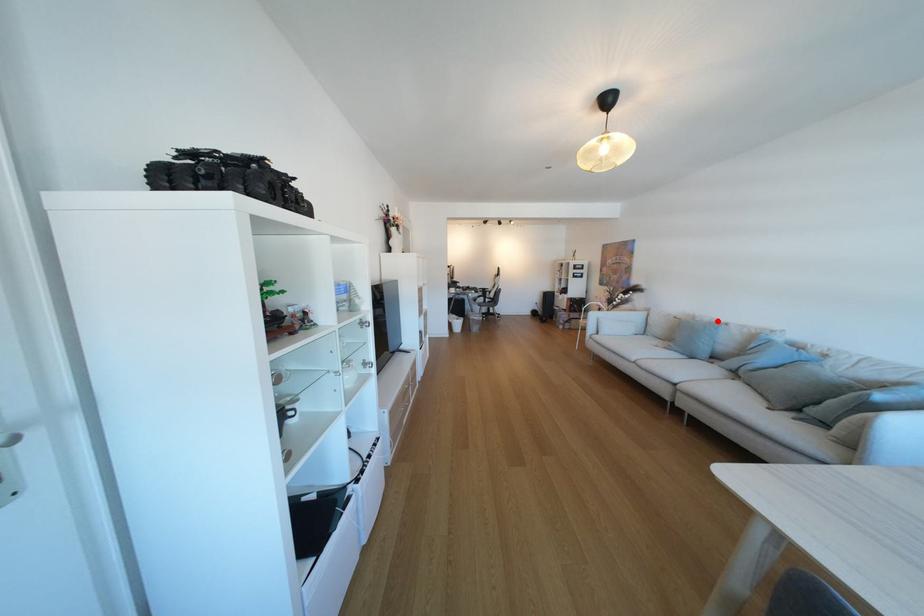
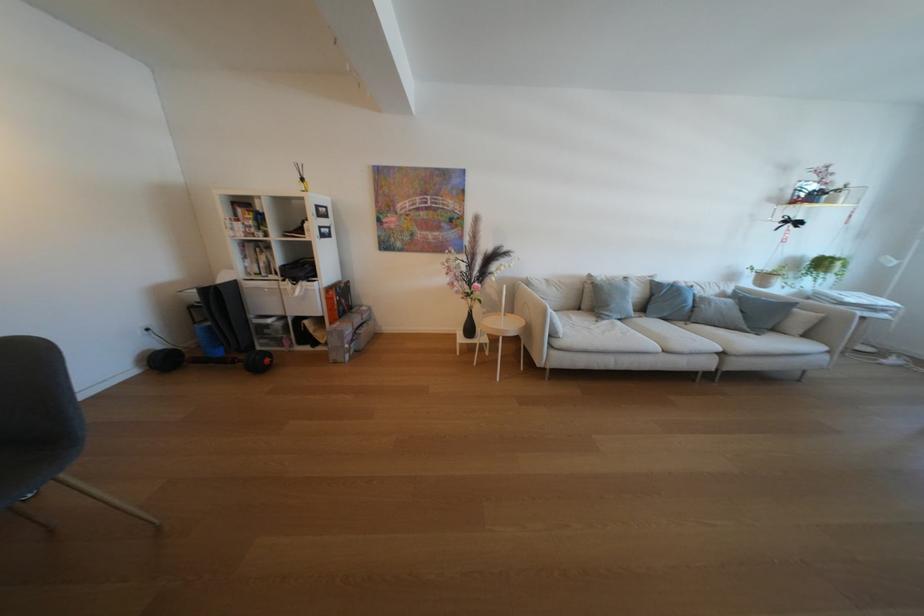
The point at the highlighted location is marked in the first image. Where is the corresponding point in the second image?

(614, 278)